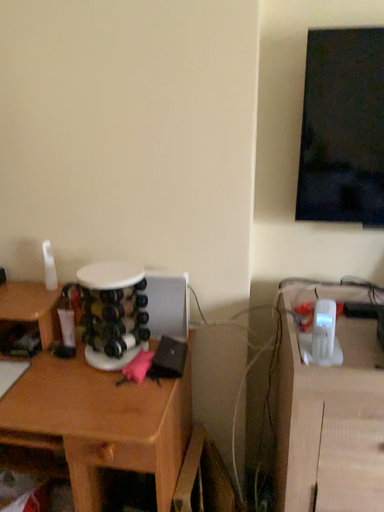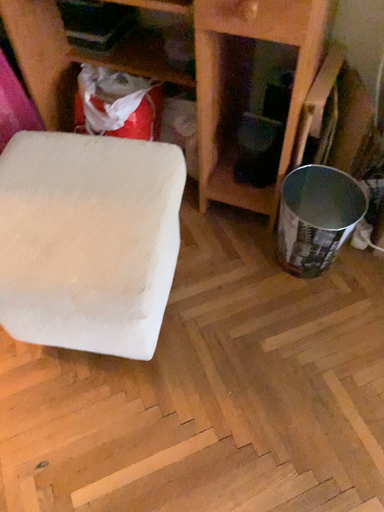
Question: Which way did the camera rotate in the video?

Choices:
 (A) rotated left
 (B) rotated right

Answer: (A)